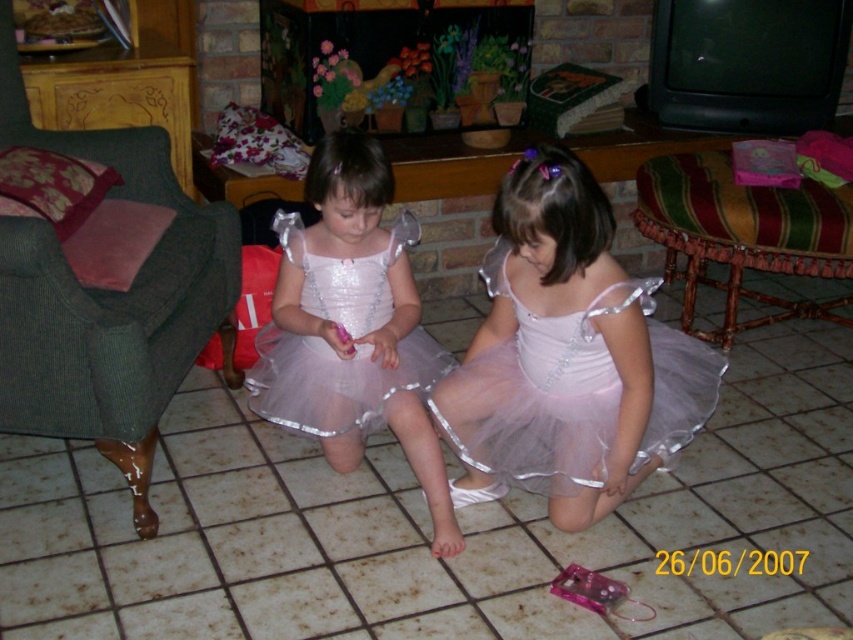
You are a photographer setting up a shoot in the living room. You need to position a small prop between the pink tulle dress at center and the striped fabric cushion at right. Based on their positions, where should you place the prop to ensure it is between them?

The prop should be placed between the pink tulle dress at center and the striped fabric cushion at right, as the pink tulle dress at center is in front of the striped fabric cushion at right, so positioning it in the space between them would place it correctly.

You are a photographer setting up for a photoshoot in the living room. You need to position a small prop between the pink tulle dress at center and the striped fabric cushion at right. Based on their positions, where should you place the prop to ensure it is between them?

The pink tulle dress at center is located below the striped fabric cushion at right. To place the prop between them, position it in the space between the dress and the cushion, ensuring it is above the dress and below the cushion.